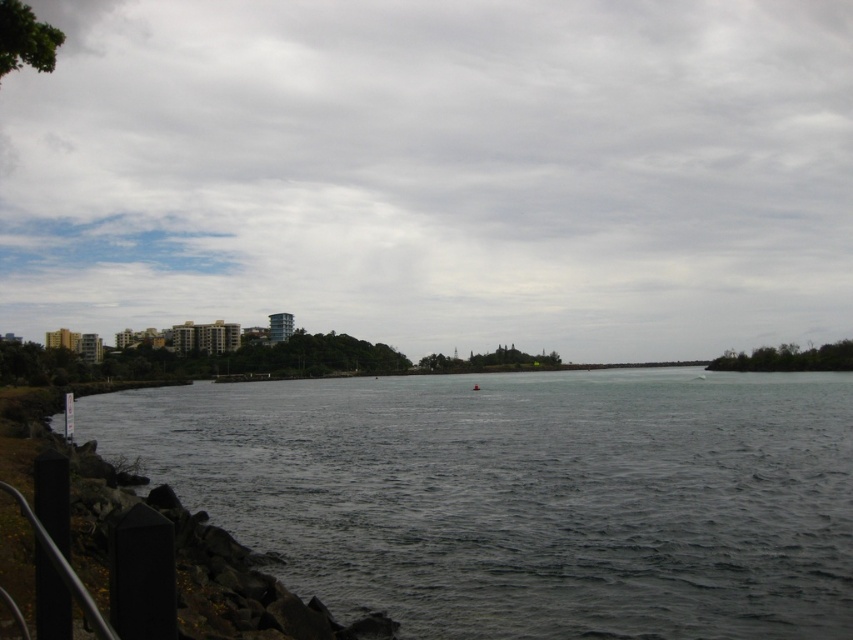
Is gray cloudy sky at upper center shorter than dark gray water at center?

Incorrect, gray cloudy sky at upper center's height does not fall short of dark gray water at center's.

Can you confirm if gray cloudy sky at upper center is smaller than dark gray water at center?

Incorrect, gray cloudy sky at upper center is not smaller in size than dark gray water at center.

This screenshot has height=640, width=853. Find the location of `gray cloudy sky at upper center`. gray cloudy sky at upper center is located at coordinates (437, 172).